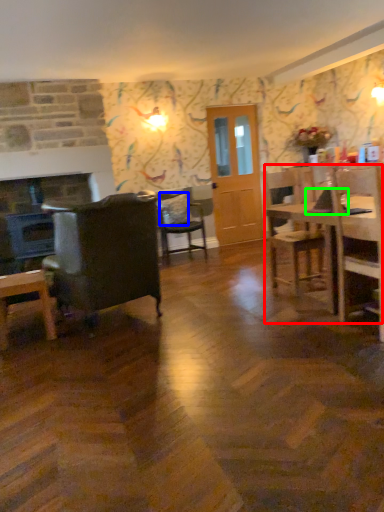
Question: Which object is positioned farthest from kitchen & dining room table (highlighted by a red box)? Select from pillow (highlighted by a blue box) and laptop (highlighted by a green box).

Choices:
 (A) pillow
 (B) laptop

Answer: (A)